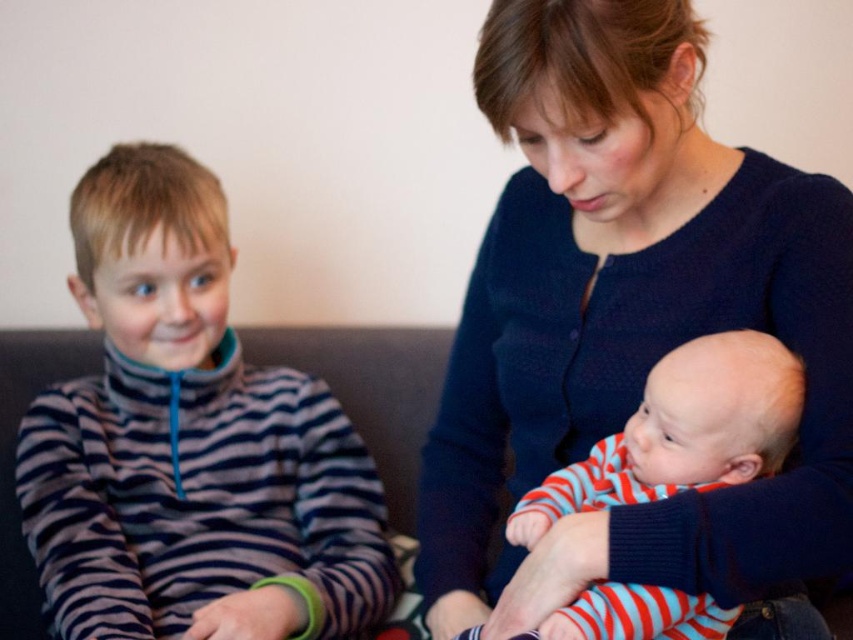
You are trying to place a new decorative pillow on the sofa. The sofa has a space between the blue textured sweater at center and the striped cotton baby at center. Can the pillow fit in this space if it is 10 cm wide?

The blue textured sweater at center might be wider than striped cotton baby at center, so the space between them may not be sufficient for a 10 cm wide pillow. Check the actual width before placing it.

Based on the coordinates provided, where is the striped fabric shirt at left located in the image?

The striped fabric shirt at left is located at point 0.694 on the x axis and 0.223 on the y axis.

Based on the photo, you are organizing a clothing donation drive and need to categorize items by size. You have two garments in front of you, the blue textured sweater at center and the striped fabric shirt at left. Based on their widths, which one should be placed in the larger size section?

The striped fabric shirt at left should be placed in the larger size section because the blue textured sweater at center has a lesser width compared to striped fabric shirt at left.